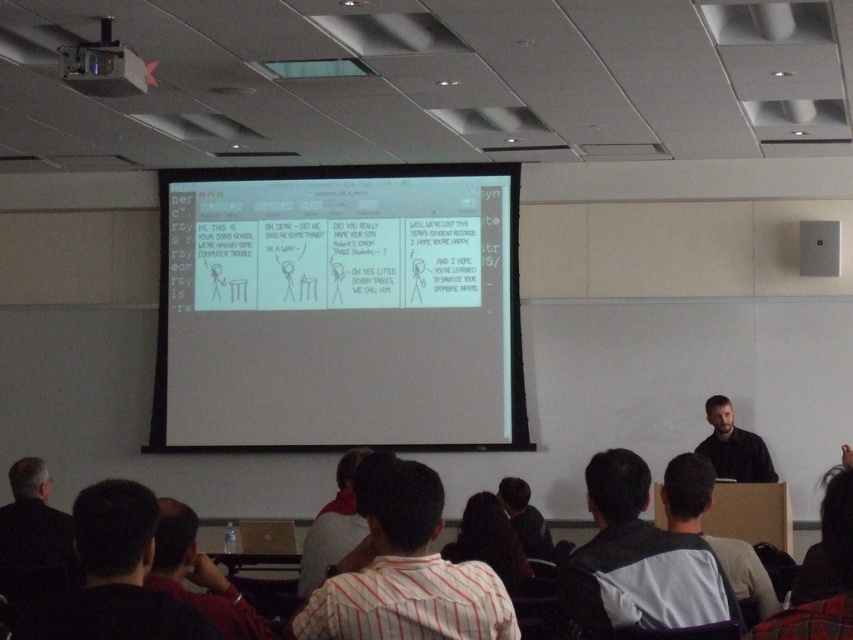
In the scene shown: Can you confirm if dark brown hair at lower left is positioned to the left of dark brown shirt at lower left?

Indeed, dark brown hair at lower left is positioned on the left side of dark brown shirt at lower left.

Is dark brown hair at lower left above dark brown shirt at lower left?

Correct, dark brown hair at lower left is located above dark brown shirt at lower left.

What do you see at coordinates (117, 573) in the screenshot? I see `dark brown hair at lower left` at bounding box center [117, 573].

This screenshot has width=853, height=640. In order to click on dark brown hair at lower left in this screenshot , I will do (x=117, y=573).

Can you confirm if gray striped shirt at lower right is shorter than black matte shirt at center?

Yes.

Identify the location of gray striped shirt at lower right. coord(712,536).

Is point (740, 589) positioned before point (708, 442)?

Yes, it is.

You are a GUI agent. You are given a task and a screenshot of the screen. Output one action in this format:
    pyautogui.click(x=<x>, y=<y>)
    Task: Click on the gray striped shirt at lower right
    Image resolution: width=853 pixels, height=640 pixels.
    Given the screenshot: What is the action you would take?
    pyautogui.click(x=712, y=536)

Can you confirm if white striped shirt at center is positioned above white shirt at center?

Indeed, white striped shirt at center is positioned over white shirt at center.

The height and width of the screenshot is (640, 853). Describe the element at coordinates (405, 573) in the screenshot. I see `white striped shirt at center` at that location.

Image resolution: width=853 pixels, height=640 pixels. In order to click on white striped shirt at center in this screenshot , I will do `click(405, 573)`.